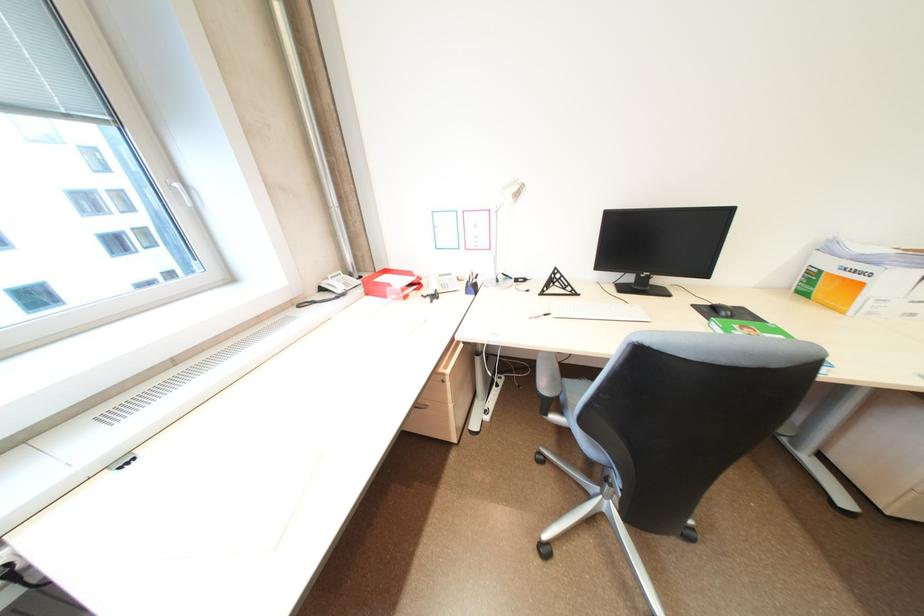
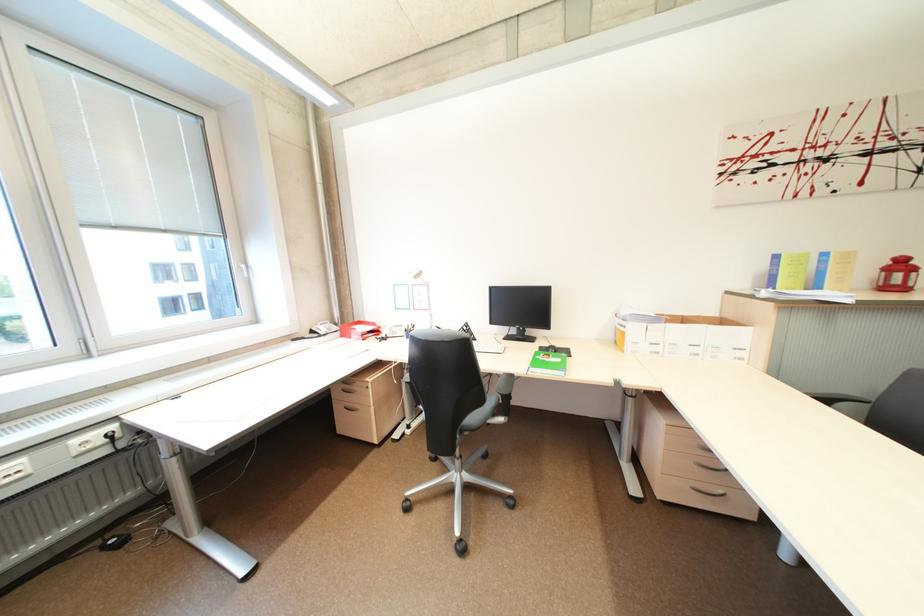
The point at (869, 286) is marked in the first image. Where is the corresponding point in the second image?

(633, 334)